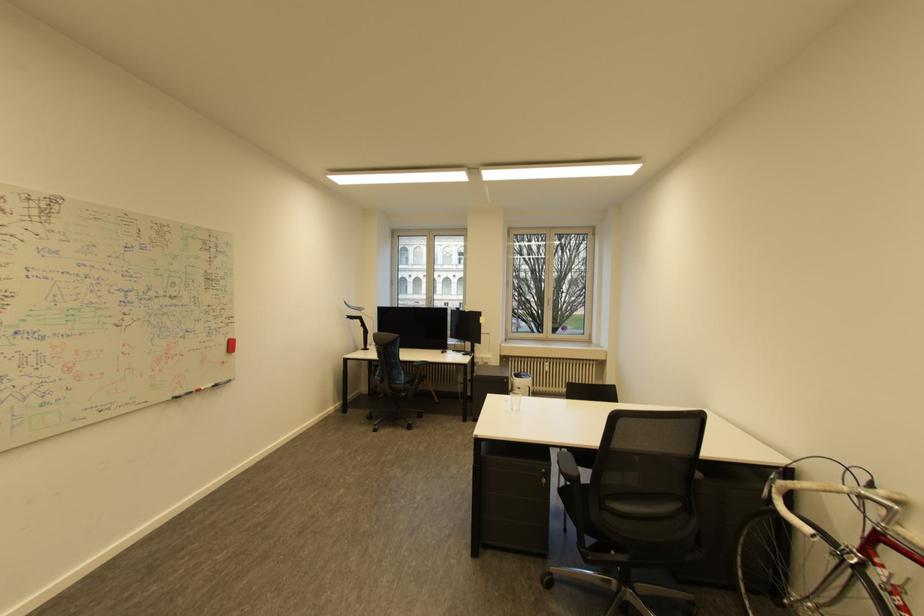
Image resolution: width=924 pixels, height=616 pixels. What do you see at coordinates (548, 304) in the screenshot?
I see `the white window handle` at bounding box center [548, 304].